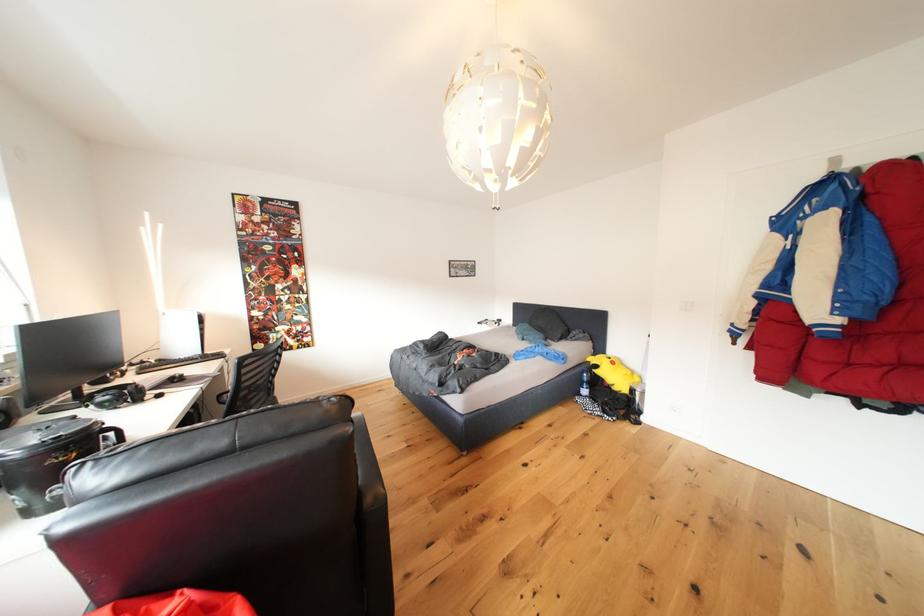
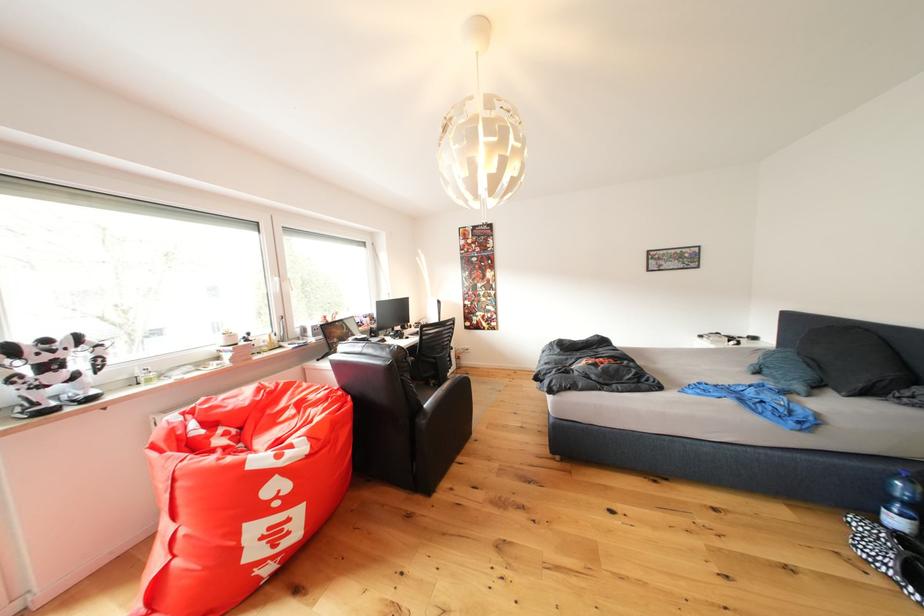
The point at (594,397) is marked in the first image. Where is the corresponding point in the second image?

(906, 527)